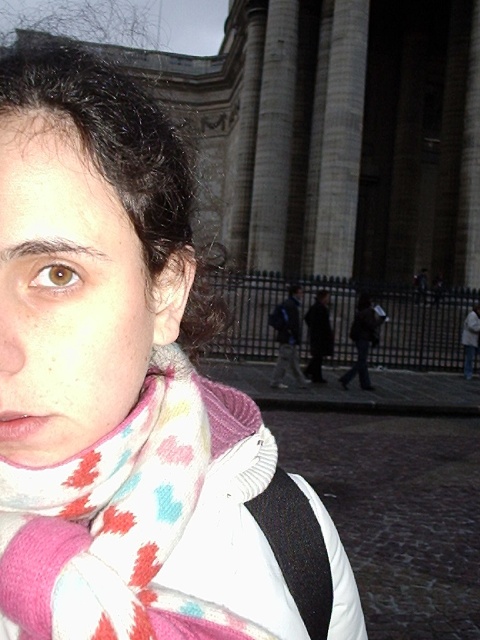
Question: Which of the following is the closest to the observer?

Choices:
 (A) blue backpack at center
 (B) white and multicolored scarf at center

Answer: (B)

Question: Can you confirm if white and multicolored scarf at center is bigger than blue backpack at center?

Choices:
 (A) no
 (B) yes

Answer: (A)

Question: Does white and multicolored scarf at center lie behind blue backpack at center?

Choices:
 (A) yes
 (B) no

Answer: (B)

Question: Can you confirm if white and multicolored scarf at center is bigger than blue backpack at center?

Choices:
 (A) yes
 (B) no

Answer: (B)